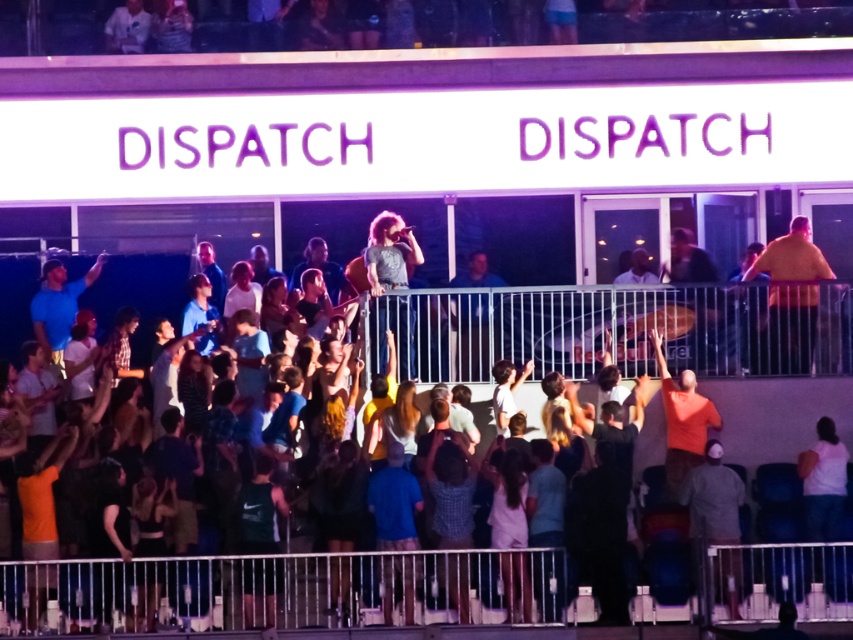
Question: Based on their relative distances, which object is farther from the metallic silver rail at upper center?

Choices:
 (A) dark gray t-shirt at center
 (B) orange cotton shirt at right
 (C) silver metallic rail at lower center
 (D) matte gray shirt at upper center

Answer: (C)

Question: Does matte gray shirt at upper center have a greater width compared to dark gray t-shirt at center?

Choices:
 (A) yes
 (B) no

Answer: (A)

Question: Among these objects, which one is nearest to the camera?

Choices:
 (A) metallic silver rail at upper center
 (B) dark gray t-shirt at center

Answer: (A)

Question: Does matte gray shirt at upper center appear on the right side of orange cotton shirt at right?

Choices:
 (A) yes
 (B) no

Answer: (B)

Question: Is silver metallic rail at lower center positioned in front of metallic silver rail at upper center?

Choices:
 (A) yes
 (B) no

Answer: (A)

Question: Which object is the closest to the metallic silver rail at upper center?

Choices:
 (A) silver metallic rail at lower center
 (B) matte gray shirt at upper center
 (C) orange cotton shirt at right
 (D) dark gray t-shirt at center

Answer: (B)